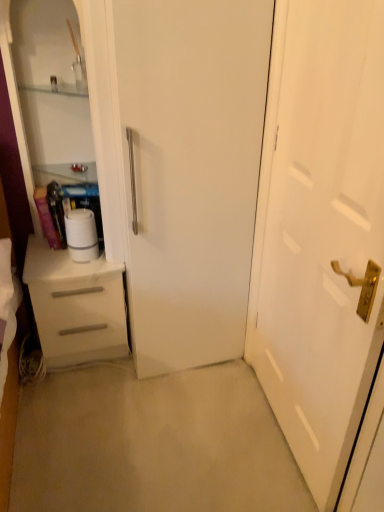
What do you see at coordinates (102, 223) in the screenshot? This screenshot has width=384, height=512. I see `white glossy dresser at left` at bounding box center [102, 223].

Measure the distance between point (105, 332) and camera.

They are 1.89 meters apart.

What do you see at coordinates (81, 234) in the screenshot? I see `white matte paper towel at left` at bounding box center [81, 234].

What are the coordinates of `white glossy door at center` in the screenshot? It's located at (320, 230).

What do you see at coordinates (320, 230) in the screenshot?
I see `white glossy door at center` at bounding box center [320, 230].

At what (x,y) coordinates should I click in order to perform the action: click on white glossy dresser at left. Please return your answer as a coordinate pair (x, y). This screenshot has height=512, width=384. Looking at the image, I should click on (102, 223).

Is white glossy dresser at left not within white matte paper towel at left?

white glossy dresser at left is positioned outside white matte paper towel at left.

Is white glossy dresser at left oriented away from white matte paper towel at left?

No, white glossy dresser at left is not facing the opposite direction of white matte paper towel at left.

From a real-world perspective, which object rests below the other?

white matte paper towel at left is physically lower.

Is there a large distance between white glossy dresser at left and white matte paper towel at left?

No, white glossy dresser at left is in close proximity to white matte paper towel at left.

Is there a large distance between white matte paper towel at left and white glossy door at center?

Actually, white matte paper towel at left and white glossy door at center are a little close together.

Locate an element on the screen. Image resolution: width=384 pixels, height=512 pixels. paper towel above the white glossy door at center (from the image's perspective) is located at coordinates (81, 234).

From a real-world perspective, is white matte paper towel at left positioned above or below white glossy door at center?

white matte paper towel at left is situated lower than white glossy door at center in the real world.

Considering the sizes of objects white glossy door at center and white matte drawer at left in the image provided, who is smaller, white glossy door at center or white matte drawer at left?

With smaller size is white glossy door at center.

From the image's perspective, is white glossy door at center under white matte drawer at left?

No.

Between white glossy door at center and white matte drawer at left, which one has less height?

Standing shorter between the two is white matte drawer at left.

Considering the positions of point (303, 193) and point (123, 305), is point (303, 193) closer or farther from the camera than point (123, 305)?

Clearly, point (303, 193) is closer to the camera than point (123, 305).

Is there a large distance between white glossy dresser at left and white glossy door at center?

white glossy dresser at left is near white glossy door at center, not far away.

Which of these two, white glossy dresser at left or white glossy door at center, is thinner?

white glossy door at center is thinner.

Is white glossy dresser at left facing towards white glossy door at center?

No, white glossy dresser at left is not facing towards white glossy door at center.

Does point (114, 170) come farther from viewer compared to point (380, 20)?

Yes, point (114, 170) is behind point (380, 20).

In the image, is white matte paper towel at left positioned in front of or behind white matte drawer at left?

Clearly, white matte paper towel at left is behind white matte drawer at left.

Between white matte paper towel at left and white matte drawer at left, which one appears on the right side from the viewer's perspective?

From the viewer's perspective, white matte paper towel at left appears more on the right side.

Could you tell me if white matte paper towel at left is turned towards white matte drawer at left?

No, white matte paper towel at left is not turned towards white matte drawer at left.

Considering the relative sizes of white glossy dresser at left and white matte drawer at left in the image provided, is white glossy dresser at left smaller than white matte drawer at left?

Incorrect, white glossy dresser at left is not smaller in size than white matte drawer at left.

The width and height of the screenshot is (384, 512). In order to click on drawer on the left side of white glossy dresser at left in this screenshot , I will do `click(80, 315)`.

Is white glossy dresser at left turned away from white matte drawer at left?

No.

Looking at this image, in terms of height, does white matte drawer at left look taller or shorter compared to white matte paper towel at left?

In the image, white matte drawer at left appears to be taller than white matte paper towel at left.

Which of these two, white matte drawer at left or white matte paper towel at left, is thinner?

Thinner between the two is white matte paper towel at left.

In order to click on drawer to the left of white matte paper towel at left in this screenshot , I will do `click(80, 315)`.

Find the location of a particular element. Image resolution: width=384 pixels, height=512 pixels. dresser that is above the white matte paper towel at left (from the image's perspective) is located at coordinates (102, 223).

At what (x,y) coordinates should I click in order to perform the action: click on paper towel on the left of white glossy door at center. Please return your answer as a coordinate pair (x, y). Image resolution: width=384 pixels, height=512 pixels. Looking at the image, I should click on (81, 234).

Based on the photo, which object lies nearer to the anchor point white matte drawer at left, white matte paper towel at left or white glossy dresser at left?

white glossy dresser at left is positioned closer to the anchor white matte drawer at left.

Considering their positions, is white matte drawer at left positioned further to white glossy dresser at left than white glossy door at center?

Based on the image, white glossy door at center appears to be further to white glossy dresser at left.

Considering their positions, is white glossy dresser at left positioned further to white matte drawer at left than white matte paper towel at left?

Among the two, white matte paper towel at left is located further to white matte drawer at left.

When comparing their distances from white glossy door at center, does white matte paper towel at left or white glossy dresser at left seem closer?

white glossy dresser at left is positioned closer to the anchor white glossy door at center.

From the image, which object appears to be farther from white matte drawer at left, white glossy door at center or white matte paper towel at left?

white glossy door at center is further to white matte drawer at left.

Which object lies further to the anchor point white glossy dresser at left, white matte paper towel at left or white glossy door at center?

Based on the image, white glossy door at center appears to be further to white glossy dresser at left.

Looking at the image, which one is located further to white matte drawer at left, white glossy door at center or white glossy dresser at left?

white glossy door at center.

Looking at the image, which one is located closer to white glossy dresser at left, white matte drawer at left or white matte paper towel at left?

white matte drawer at left is positioned closer to the anchor white glossy dresser at left.

Find the location of a particular element. The image size is (384, 512). dresser between white matte drawer at left and white glossy door at center in the horizontal direction is located at coordinates (102, 223).

Image resolution: width=384 pixels, height=512 pixels. What are the coordinates of `paper towel between white glossy dresser at left and white matte drawer at left from top to bottom` in the screenshot? It's located at (81, 234).

Where is `drawer between white glossy door at center and white matte paper towel at left in the front-back direction`? drawer between white glossy door at center and white matte paper towel at left in the front-back direction is located at coordinates (80, 315).

Identify the location of dresser between white glossy door at center and white matte paper towel at left along the z-axis. (102, 223).